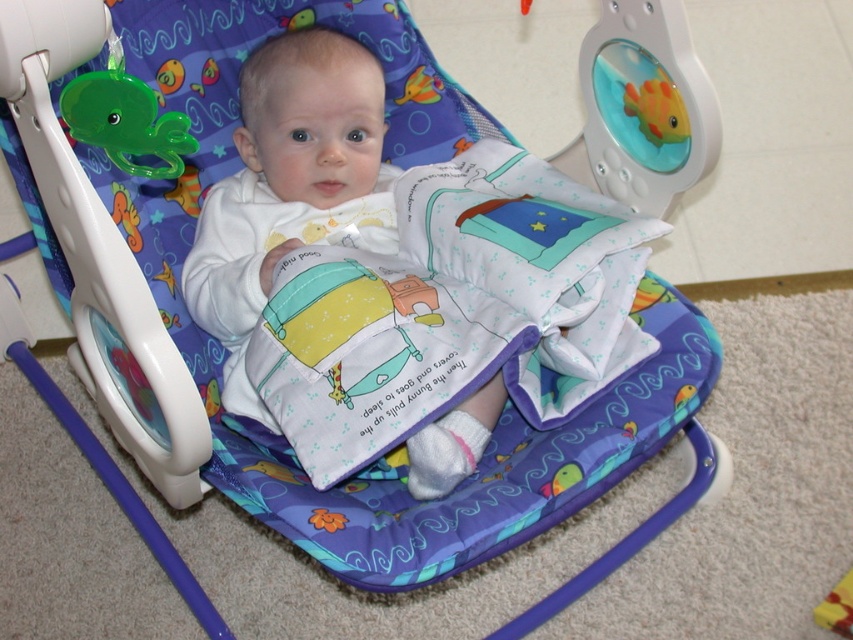
Does white soft baby at center appear over green plastic octopus at upper left?

No, white soft baby at center is not above green plastic octopus at upper left.

At what (x,y) coordinates should I click in order to perform the action: click on white soft baby at center. Please return your answer as a coordinate pair (x, y). This screenshot has width=853, height=640. Looking at the image, I should click on (289, 188).

Is point (354, 211) farther from camera compared to point (90, 88)?

Yes, point (354, 211) is behind point (90, 88).

Where is `white soft baby at center`? Image resolution: width=853 pixels, height=640 pixels. white soft baby at center is located at coordinates (289, 188).